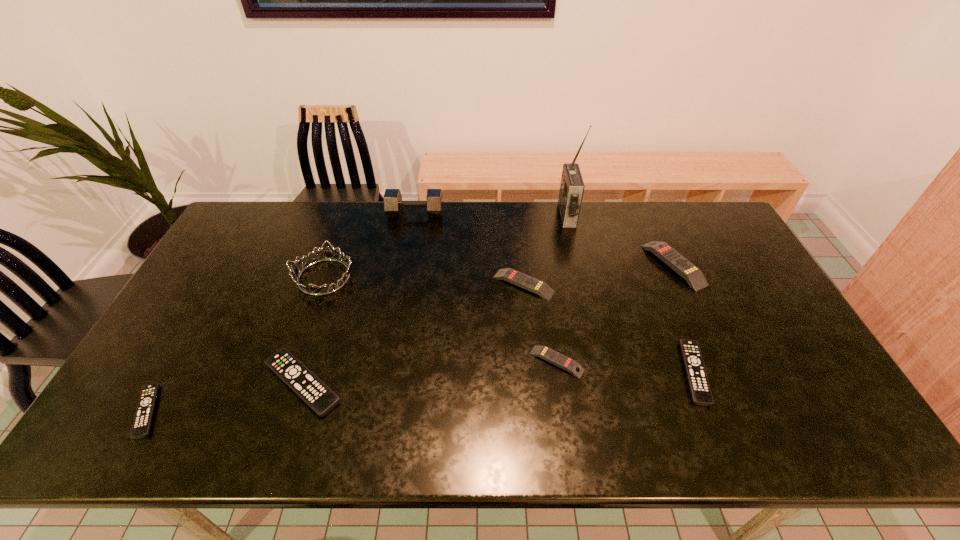
This screenshot has width=960, height=540. Find the location of `free space between the rightmost black remote control and the third object from right to left`. free space between the rightmost black remote control and the third object from right to left is located at coordinates (631, 294).

The height and width of the screenshot is (540, 960). I want to click on free point between the rightmost black remote control and the leftmost remote control, so click(420, 392).

Where is `vacant space that is in between the smallest black remote control and the rightmost black remote control`? This screenshot has height=540, width=960. vacant space that is in between the smallest black remote control and the rightmost black remote control is located at coordinates (420, 392).

Locate an element on the screen. This screenshot has height=540, width=960. free area in between the smallest yellow remote control and the tallest remote control is located at coordinates tap(615, 313).

I want to click on the third closest object to the rightmost black remote control, so click(x=539, y=287).

Select which object appears as the eighth closest to the rightmost yellow remote control. Please provide its 2D coordinates. Your answer should be formatted as a tuple, i.e. [(x, y)], where the tuple contains the x and y coordinates of a point satisfying the conditions above.

[(143, 417)]

Locate an element on the screen. remote control that is the third closest one to the second remote control from left to right is located at coordinates (556, 358).

Locate which remote control ranks fifth in proximity to the second smallest black remote control. Please provide its 2D coordinates. Your answer should be formatted as a tuple, i.e. [(x, y)], where the tuple contains the x and y coordinates of a point satisfying the conditions above.

[(143, 417)]

Point out which yellow remote control is positioned as the second nearest to the nearest yellow remote control. Please provide its 2D coordinates. Your answer should be formatted as a tuple, i.e. [(x, y)], where the tuple contains the x and y coordinates of a point satisfying the conditions above.

[(693, 275)]

At what (x,y) coordinates should I click in order to perform the action: click on yellow remote control that is the second closest to the third object from right to left. Please return your answer as a coordinate pair (x, y). The height and width of the screenshot is (540, 960). Looking at the image, I should click on (539, 287).